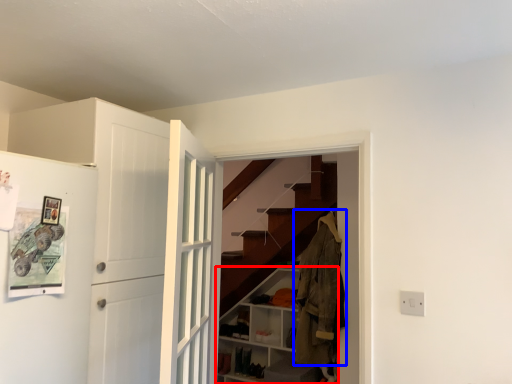
Question: Which object appears farthest to the camera in this image, cabinetry (highlighted by a red box) or clothing (highlighted by a blue box)?

Choices:
 (A) cabinetry
 (B) clothing

Answer: (A)